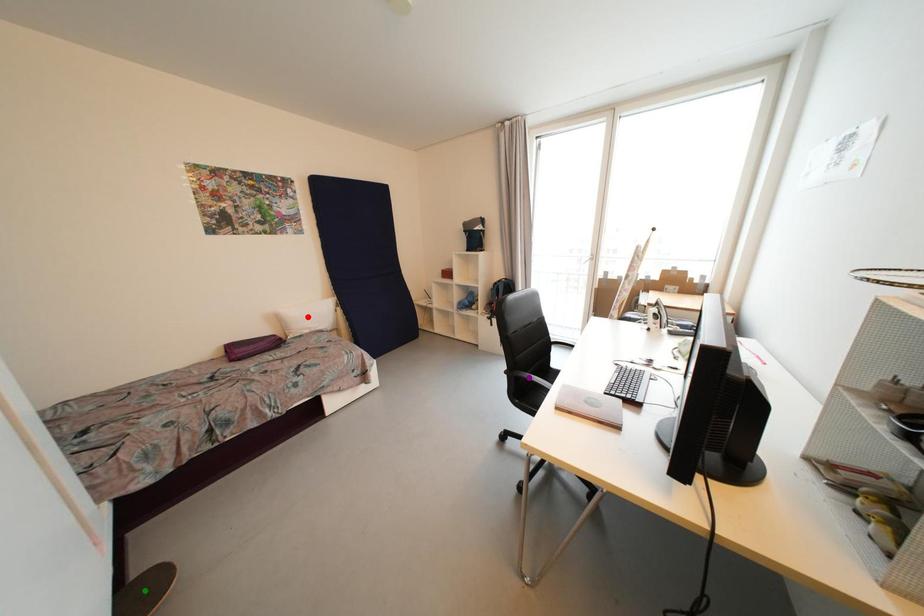
Order these from nearest to farthest:
red point | green point | purple point

1. purple point
2. red point
3. green point